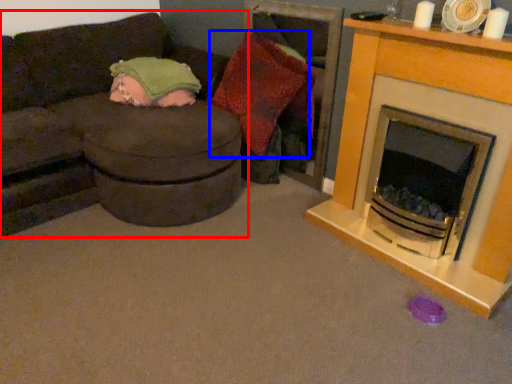
Question: Among these objects, which one is farthest to the camera, studio couch (highlighted by a red box) or pillow (highlighted by a blue box)?

Choices:
 (A) studio couch
 (B) pillow

Answer: (B)